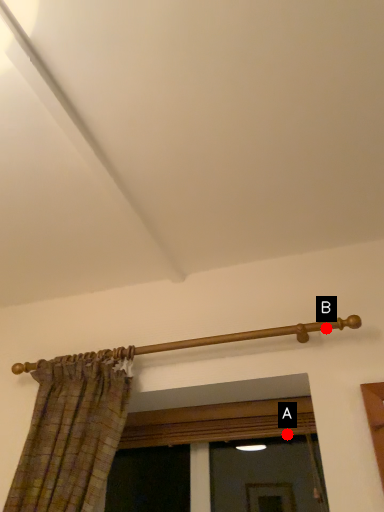
Question: Two points are circled on the image, labeled by A and B beside each circle. Among these points, which one is nearest to the camera?

Choices:
 (A) A is closer
 (B) B is closer

Answer: (B)